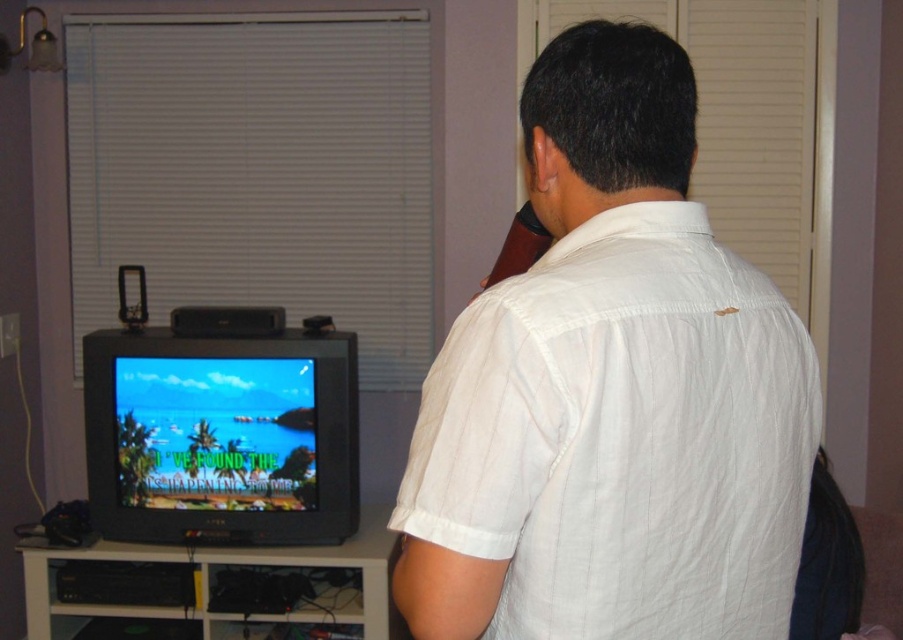
Question: Which point is farther to the camera?

Choices:
 (A) shiny black tv at lower left
 (B) white cotton shirt at back
 (C) white wood entertainment center at lower left

Answer: (A)

Question: Can you confirm if white cotton shirt at back is positioned to the right of shiny black tv at lower left?

Choices:
 (A) yes
 (B) no

Answer: (A)

Question: Can you confirm if white cotton shirt at back is bigger than white wood entertainment center at lower left?

Choices:
 (A) no
 (B) yes

Answer: (A)

Question: Can you confirm if white cotton shirt at back is positioned to the right of white wood entertainment center at lower left?

Choices:
 (A) no
 (B) yes

Answer: (B)

Question: Considering the real-world distances, which object is farthest from the white cotton shirt at back?

Choices:
 (A) shiny black tv at lower left
 (B) white wood entertainment center at lower left

Answer: (B)

Question: Which of the following is the closest to the observer?

Choices:
 (A) shiny black tv at lower left
 (B) white cotton shirt at back
 (C) white wood entertainment center at lower left

Answer: (B)